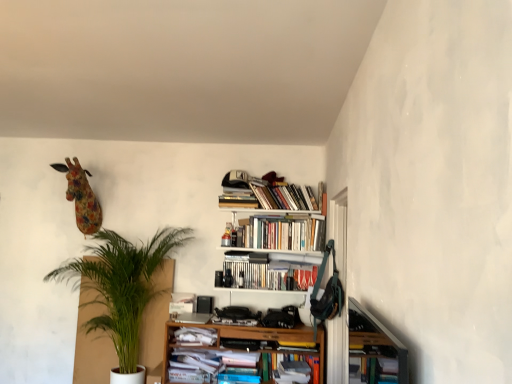
Question: From a real-world perspective, is floral fabric giraffe at upper left above or below hardcover books at upper center, the 1th book viewed from the top?

Choices:
 (A) below
 (B) above

Answer: (A)

Question: Is point (89, 185) closer or farther from the camera than point (292, 190)?

Choices:
 (A) closer
 (B) farther

Answer: (B)

Question: Considering the real-world distances, which object is closest to the wooden bookshelf at lower right?

Choices:
 (A) green leafy plant at left
 (B) hardcover book at center, the 5th book from the top
 (C) hardcover books at center, the 3th book positioned from the bottom
 (D) floral fabric giraffe at upper left
 (E) white wooden bookshelf at upper center

Answer: (B)

Question: Based on their relative distances, which object is nearer to the floral fabric giraffe at upper left?

Choices:
 (A) white wooden bookshelf at upper center
 (B) hardcover books at center, the 3th book positioned from the bottom
 (C) hardcover books at upper center, the 1th book viewed from the top
 (D) white paper at lower center, marked as the 2th book in a bottom-to-top arrangement
 (E) green leafy plant at left

Answer: (E)